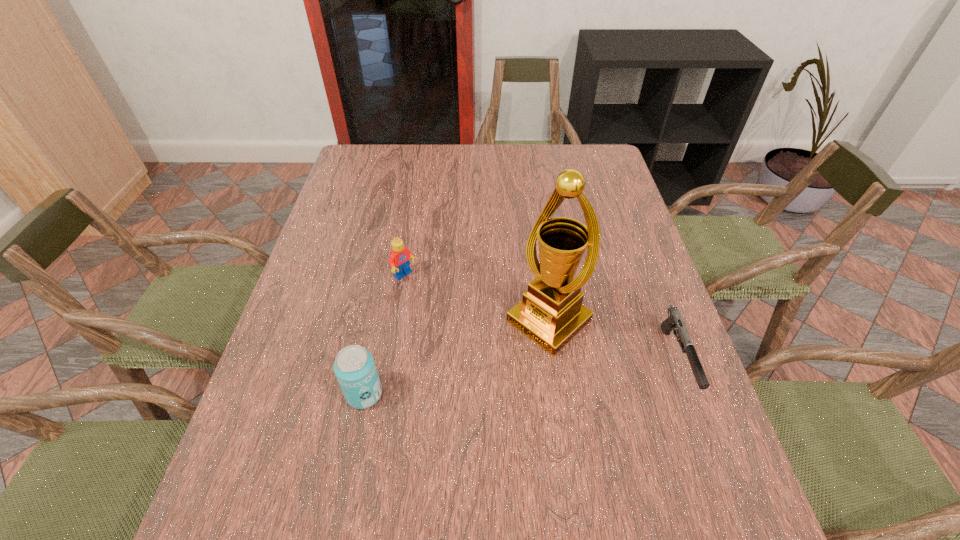
Locate an element on the screen. free space on the desktop that is between the beer can and the shortest object and is positioned on the front-facing side of the second object from right to left is located at coordinates (480, 381).

Image resolution: width=960 pixels, height=540 pixels. In order to click on free spot on the desktop that is between the beer can and the rightmost object and is positioned on the face of the Lego in this screenshot , I will do `click(522, 377)`.